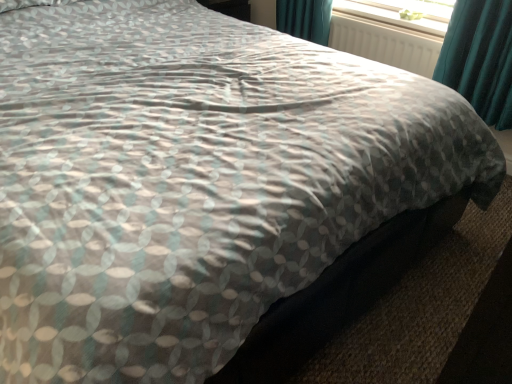
You are a GUI agent. You are given a task and a screenshot of the screen. Output one action in this format:
    pyautogui.click(x=<x>, y=<y>)
    Task: Click on the transparent plastic window screen at upper right
    The width and height of the screenshot is (512, 384).
    Given the screenshot: What is the action you would take?
    pyautogui.click(x=398, y=13)

In order to face transparent plastic window screen at upper right, should I rotate leftwards or rightwards?

You should look right and rotate roughly 17.093 degrees.

Describe the element at coordinates (398, 13) in the screenshot. I see `transparent plastic window screen at upper right` at that location.

The height and width of the screenshot is (384, 512). What do you see at coordinates (385, 43) in the screenshot?
I see `white textured radiator at upper center` at bounding box center [385, 43].

This screenshot has height=384, width=512. What are the coordinates of `white textured radiator at upper center` in the screenshot? It's located at (385, 43).

In order to face white textured radiator at upper center, should I rotate leftwards or rightwards?

Turn right approximately 16.438 degrees to face it.

What are the coordinates of `transparent plastic window screen at upper right` in the screenshot? It's located at (398, 13).

Does white textured radiator at upper center appear on the right side of transparent plastic window screen at upper right?

In fact, white textured radiator at upper center is to the left of transparent plastic window screen at upper right.

Does white textured radiator at upper center lie in front of transparent plastic window screen at upper right?

That is True.

Which is in front, point (352, 38) or point (388, 2)?

The point (388, 2) is closer to the camera.

From the image's perspective, is white textured radiator at upper center above or below transparent plastic window screen at upper right?

Based on their image positions, white textured radiator at upper center is located beneath transparent plastic window screen at upper right.

From the picture: From a real-world perspective, is white textured radiator at upper center beneath transparent plastic window screen at upper right?

Result: Yes, from a real-world perspective, white textured radiator at upper center is under transparent plastic window screen at upper right.

Does white textured radiator at upper center have a lesser width compared to transparent plastic window screen at upper right?

Yes.

Considering the relative sizes of white textured radiator at upper center and transparent plastic window screen at upper right in the image provided, is white textured radiator at upper center taller than transparent plastic window screen at upper right?

Yes, white textured radiator at upper center is taller than transparent plastic window screen at upper right.

Considering the sizes of white textured radiator at upper center and transparent plastic window screen at upper right in the image, is white textured radiator at upper center bigger or smaller than transparent plastic window screen at upper right?

In the image, white textured radiator at upper center appears to be larger than transparent plastic window screen at upper right.

Would you say transparent plastic window screen at upper right is part of white textured radiator at upper center's contents?

No, white textured radiator at upper center does not contain transparent plastic window screen at upper right.

Is white textured radiator at upper center not near transparent plastic window screen at upper right?

No, white textured radiator at upper center is not far from transparent plastic window screen at upper right.

Is white textured radiator at upper center facing towards transparent plastic window screen at upper right?

No, white textured radiator at upper center is not oriented towards transparent plastic window screen at upper right.

How different are the orientations of white textured radiator at upper center and transparent plastic window screen at upper right in degrees?

0.123 degrees.

Find the location of a particular element. This screenshot has height=384, width=512. window screen behind the white textured radiator at upper center is located at coordinates (398, 13).

Based on their positions, is transparent plastic window screen at upper right located to the left or right of white textured radiator at upper center?

Based on their positions, transparent plastic window screen at upper right is located to the right of white textured radiator at upper center.

Which is in front, transparent plastic window screen at upper right or white textured radiator at upper center?

Positioned in front is white textured radiator at upper center.

Between point (395, 2) and point (361, 51), which one is positioned behind?

The point (361, 51) is farther from the camera.

From the image's perspective, does transparent plastic window screen at upper right appear higher than white textured radiator at upper center?

Yes, from the image's perspective, transparent plastic window screen at upper right is over white textured radiator at upper center.

In the scene shown: From a real-world perspective, is transparent plastic window screen at upper right under white textured radiator at upper center?

No, from a real-world perspective, transparent plastic window screen at upper right is not under white textured radiator at upper center.

Is transparent plastic window screen at upper right wider or thinner than white textured radiator at upper center?

Considering their sizes, transparent plastic window screen at upper right looks broader than white textured radiator at upper center.

In the scene shown: Is transparent plastic window screen at upper right taller or shorter than white textured radiator at upper center?

In the image, transparent plastic window screen at upper right appears to be shorter than white textured radiator at upper center.

Considering the relative sizes of transparent plastic window screen at upper right and white textured radiator at upper center in the image provided, is transparent plastic window screen at upper right bigger than white textured radiator at upper center?

No.

Is transparent plastic window screen at upper right not inside white textured radiator at upper center?

Absolutely, transparent plastic window screen at upper right is external to white textured radiator at upper center.

Would you consider transparent plastic window screen at upper right to be distant from white textured radiator at upper center?

transparent plastic window screen at upper right is actually quite close to white textured radiator at upper center.

From the picture: Is transparent plastic window screen at upper right turned away from white textured radiator at upper center?

No, transparent plastic window screen at upper right is not facing the opposite direction of white textured radiator at upper center.

The width and height of the screenshot is (512, 384). Identify the location of window screen above the white textured radiator at upper center (from a real-world perspective). (398, 13).

The width and height of the screenshot is (512, 384). I want to click on window screen located behind the white textured radiator at upper center, so click(398, 13).

Locate an element on the screen. This screenshot has height=384, width=512. radiator located on the left of transparent plastic window screen at upper right is located at coordinates (385, 43).